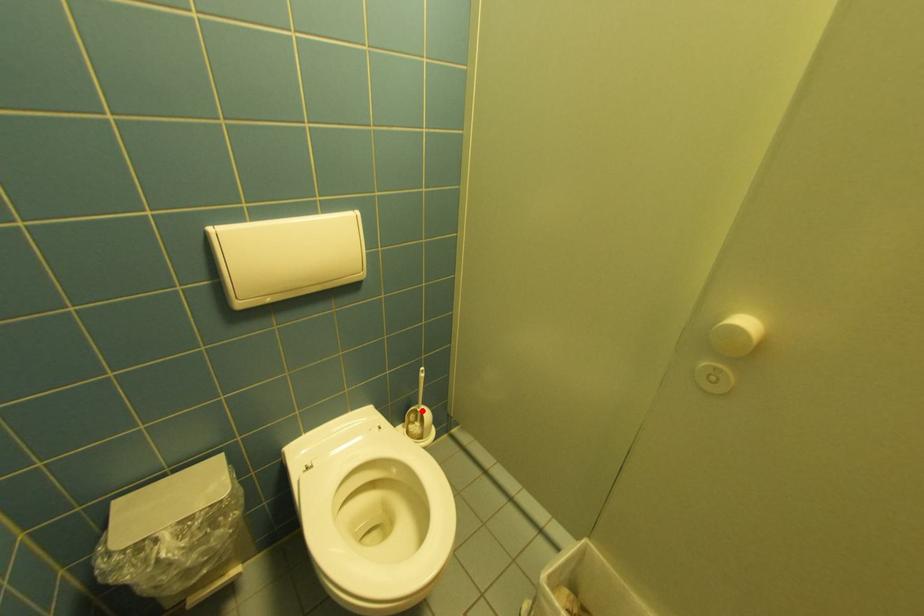
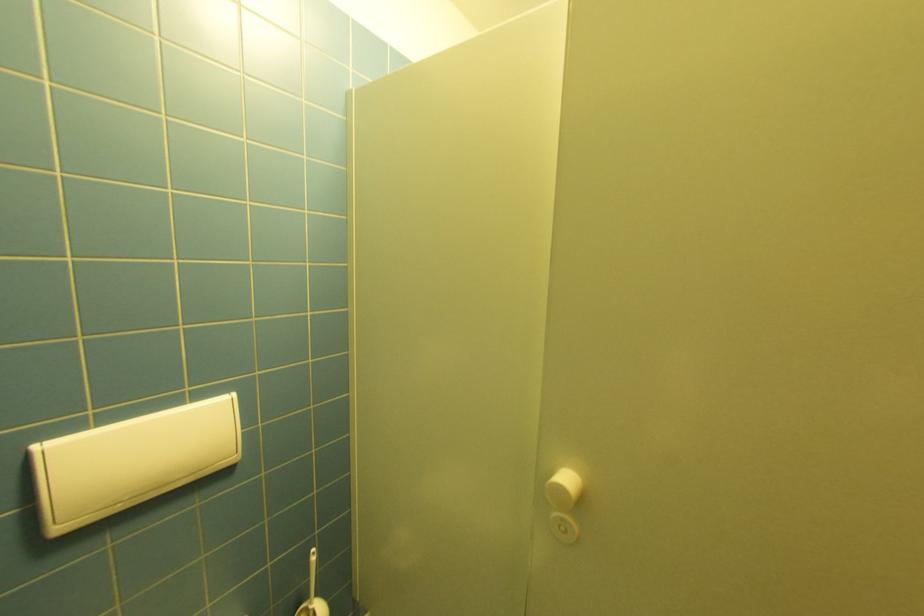
Question: I am providing you with two images of the same scene from different viewpoints. Given a red point in image1, look at the same physical point in image2. Is it:

Choices:
 (A) Closer to the viewpoint
 (B) Farther from the viewpoint

Answer: (A)